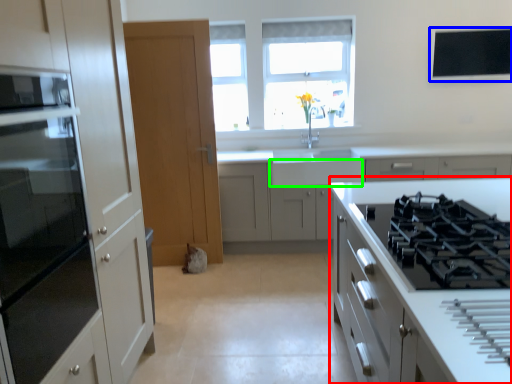
Question: Which object is the closest to the cabinetry (highlighted by a red box)? Choose among these: window screen (highlighted by a blue box) or drawer (highlighted by a green box).

Choices:
 (A) window screen
 (B) drawer

Answer: (B)